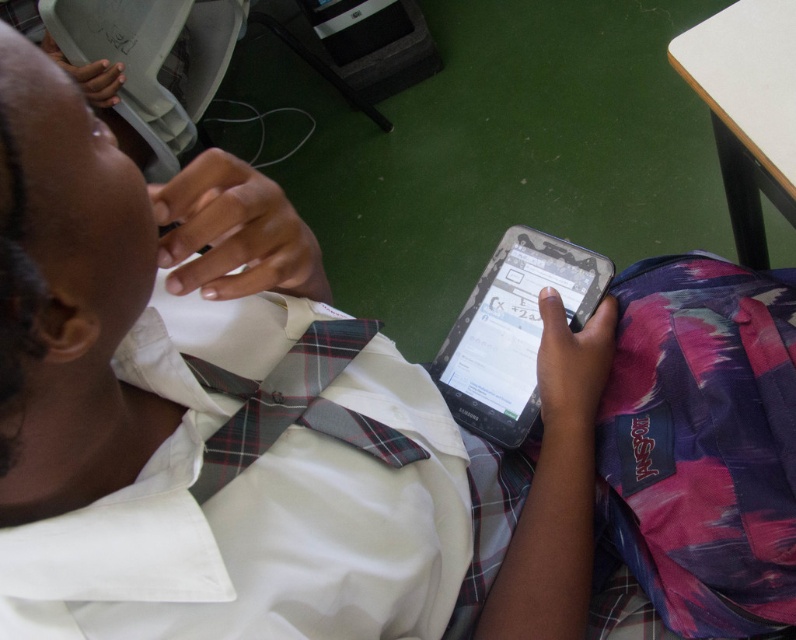
You are organizing a classroom and need to place a new poster. The poster is the same size as the plaid fabric tie at center. Will the white plastic table at upper right have enough space to accommodate the poster?

The white plastic table at upper right is bigger than the plaid fabric tie at center, so the poster will fit on the table.

From the picture: You are a person who needs to place a 12 inch tall textbook on the white plastic table at upper right. Can you determine if the textbook will fit on the table?

The distance between the white plastic table at upper right and the viewer is 28.99 inches, but this measurement does not provide information about the table size. Therefore, it is impossible to determine if the textbook will fit on the white plastic table at upper right based on the given information.

You are a student who needs to place your black matte tablet at center and plaid fabric tie at center into a storage compartment that can only accommodate items within 30 centimeters in length. Can both items fit side by side without exceeding the compartment length?

The distance between the black matte tablet at center and plaid fabric tie at center is 28.59 centimeters, which is under the 30 centimeter limit. Therefore, both items can fit side by side within the storage compartment.